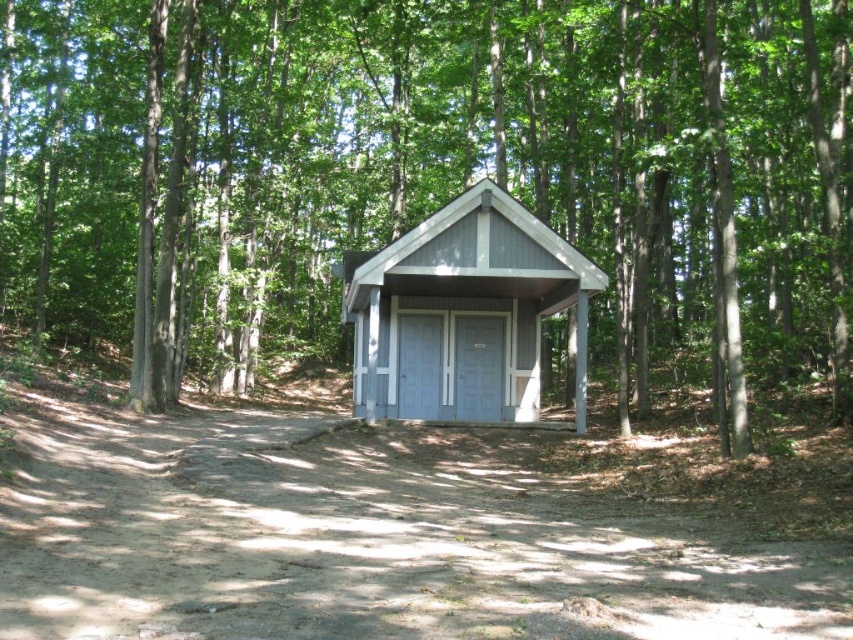
Question: Does green leafy tree at center appear on the left side of gray wood cabin at center?

Choices:
 (A) no
 (B) yes

Answer: (A)

Question: Is green leafy tree at center to the left of gray wood cabin at center from the viewer's perspective?

Choices:
 (A) no
 (B) yes

Answer: (A)

Question: Can you confirm if green leafy tree at center is positioned to the right of gray wood cabin at center?

Choices:
 (A) yes
 (B) no

Answer: (A)

Question: Which object appears closest to the camera in this image?

Choices:
 (A) green leafy tree at center
 (B) gray wood cabin at center

Answer: (A)

Question: Which point is closer to the camera?

Choices:
 (A) gray wood cabin at center
 (B) green leafy tree at center

Answer: (B)